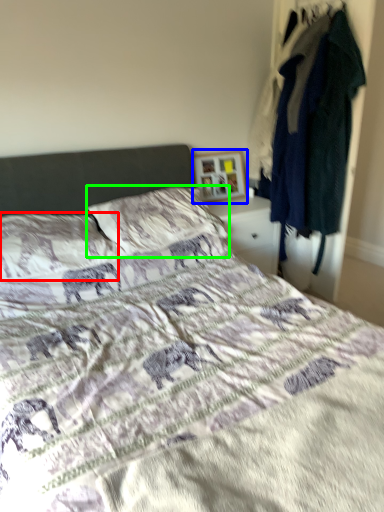
Question: Estimate the real-world distances between objects in this image. Which object is farther from pillow (highlighted by a red box), picture frame (highlighted by a blue box) or pillow (highlighted by a green box)?

Choices:
 (A) picture frame
 (B) pillow

Answer: (A)